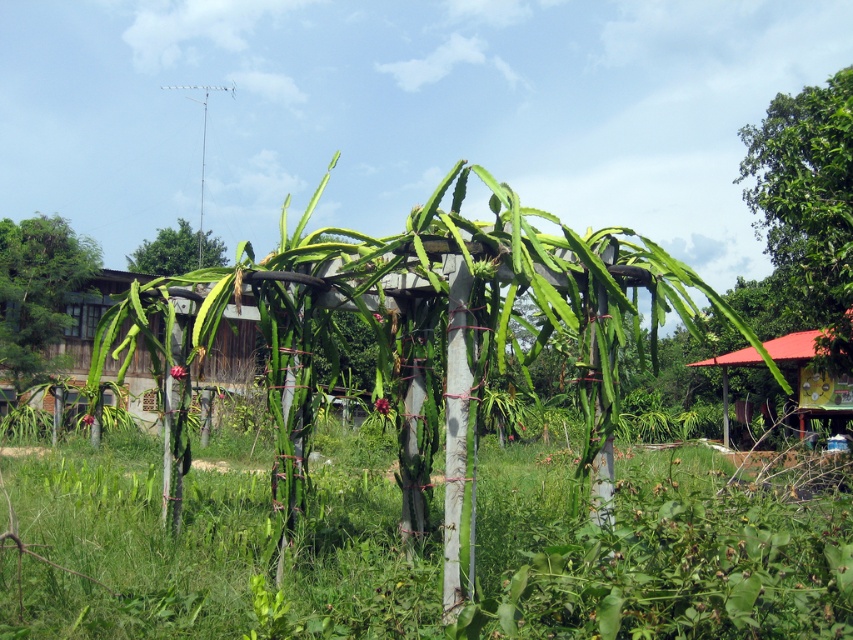
You are standing in the rural outdoor setting shown in the image. You see a green leafy grass at center located at point (207, 545). If you want to walk towards the wooden house with a dark roof and light walls, should you walk towards or away from the green leafy grass at center?

The green leafy grass at center is located at point (207, 545). Since the wooden house with a dark roof and light walls is in the background, you should walk away from the green leafy grass at center to reach it.

You are standing in the rural area looking at the scene. There is a green leafy tree at upper right and a green leafy plant at upper center. Which one is nearer to you?

The green leafy tree at upper right is closer to the viewer than the green leafy plant at upper center.

You are a gardener who wants to water both the green leafy grass at center and the green leafy plant at upper center. Which one should you water first if you start from the left side of the scene?

The green leafy plant at upper center should be watered first because the green leafy grass at center is positioned on its right side, meaning the plant is to the left of the grass.